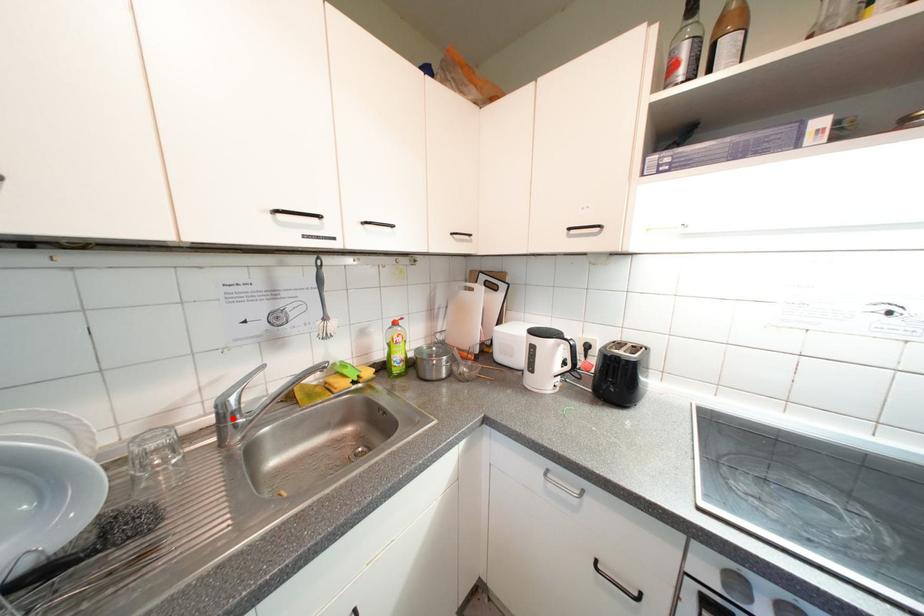
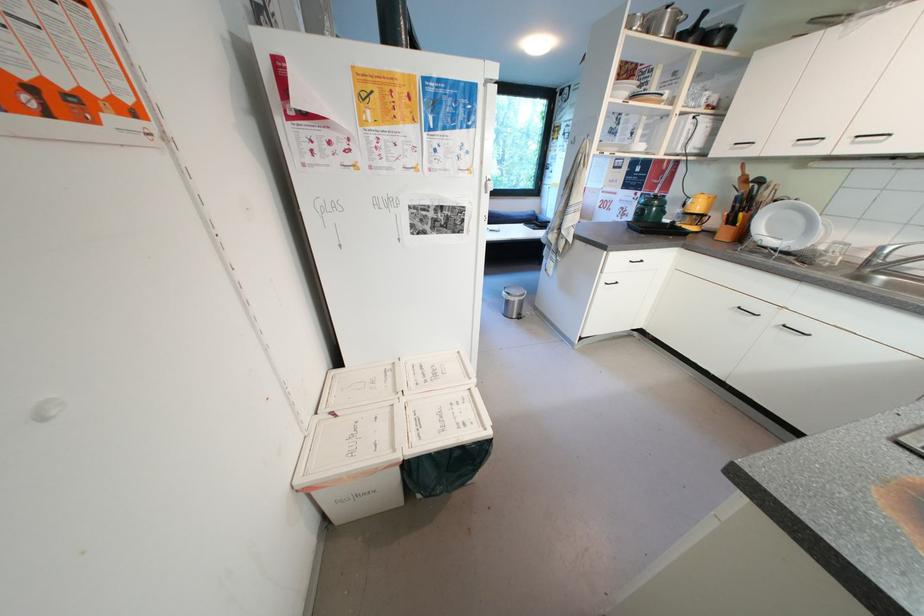
In the second image, find the point that corresponds to the highlighted location in the first image.

(883, 257)